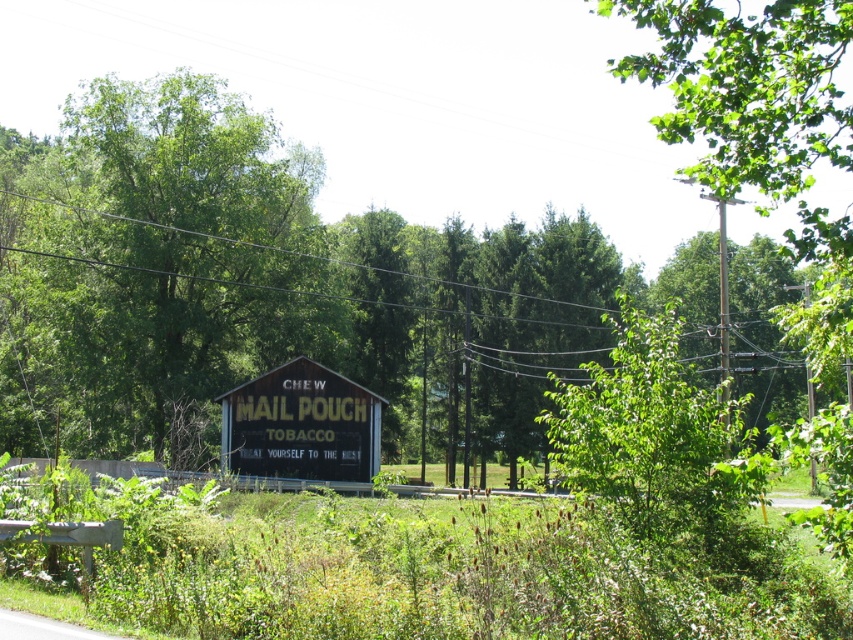
Question: Among these objects, which one is nearest to the camera?

Choices:
 (A) green leafy tree at center
 (B) yellow wooden signboard at center

Answer: (A)

Question: Does green leafy tree at center appear under yellow wooden signboard at center?

Choices:
 (A) yes
 (B) no

Answer: (B)

Question: Is green leafy tree at center closer to the viewer compared to yellow wooden signboard at center?

Choices:
 (A) yes
 (B) no

Answer: (A)

Question: Among these points, which one is nearest to the camera?

Choices:
 (A) (259, 456)
 (B) (128, 145)

Answer: (A)

Question: Does green leafy tree at center have a smaller size compared to yellow wooden signboard at center?

Choices:
 (A) yes
 (B) no

Answer: (B)